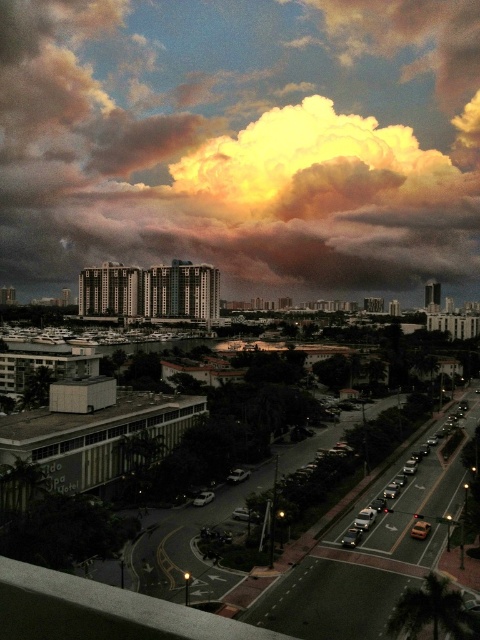
You are a drone operator trying to capture a photo of the golden textured cloud at upper center and the green leafy palm tree at lower right in the same frame. Given that your drone can only maintain a stable flight within a 300 meter radius, will you be able to capture both objects in the same photo?

The distance between the golden textured cloud at upper center and the green leafy palm tree at lower right is 334.31 meters, which exceeds the drone operator s 300 meter radius limit. Therefore, it will not be possible to capture both objects in the same photo.